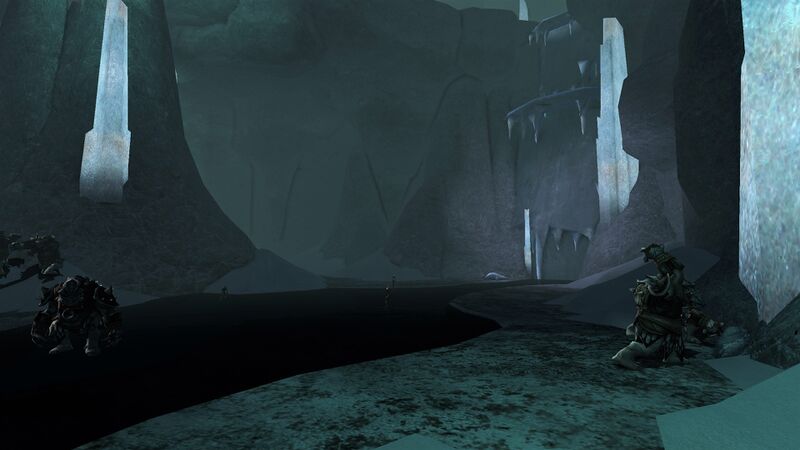
You are a GUI agent. You are given a task and a screenshot of the screen. Output one action in this format:
    pyautogui.click(x=<x>, y=<y>)
    Task: Click on the plant
    The image size is (800, 450).
    Given the screenshot: What is the action you would take?
    pyautogui.click(x=36, y=261)